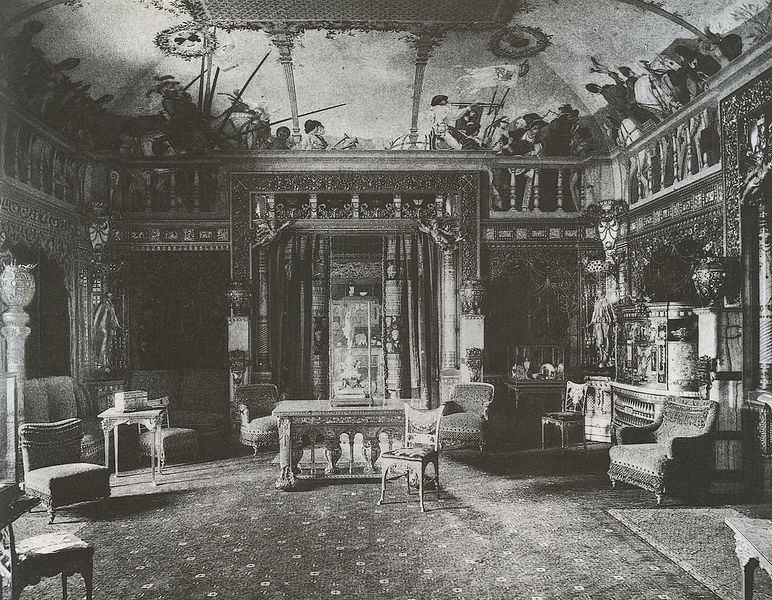
I want to click on carpet, so click(298, 550).